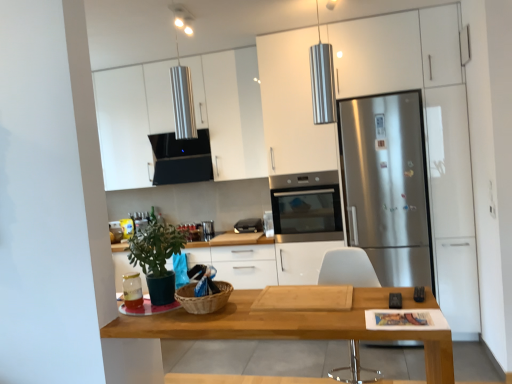
Question: Is stainless steel oven at center outside stainless steel refrigerator at right?

Choices:
 (A) yes
 (B) no

Answer: (A)

Question: Is stainless steel oven at center at the left side of stainless steel refrigerator at right?

Choices:
 (A) no
 (B) yes

Answer: (B)

Question: Does stainless steel oven at center have a smaller size compared to stainless steel refrigerator at right?

Choices:
 (A) no
 (B) yes

Answer: (B)

Question: Is stainless steel oven at center with stainless steel refrigerator at right?

Choices:
 (A) no
 (B) yes

Answer: (A)

Question: From a real-world perspective, does stainless steel oven at center stand above stainless steel refrigerator at right?

Choices:
 (A) yes
 (B) no

Answer: (A)

Question: From the image's perspective, is stainless steel oven at center located above stainless steel refrigerator at right?

Choices:
 (A) yes
 (B) no

Answer: (B)

Question: Does black plastic toaster at center, the second appliance viewed from the left, have a greater width compared to matte glass jar at lower left, placed as the second appliance when sorted from front to back?

Choices:
 (A) no
 (B) yes

Answer: (B)

Question: Considering the relative positions of black plastic toaster at center, which ranks as the first appliance in back-to-front order, and matte glass jar at lower left, which appears as the third appliance when viewed from the top, in the image provided, is black plastic toaster at center, which ranks as the first appliance in back-to-front order, to the right of matte glass jar at lower left, which appears as the third appliance when viewed from the top, from the viewer's perspective?

Choices:
 (A) yes
 (B) no

Answer: (A)

Question: Is black plastic toaster at center, arranged as the 1th appliance when viewed from the top, not close to matte glass jar at lower left, arranged as the first appliance when ordered from the bottom?

Choices:
 (A) yes
 (B) no

Answer: (A)

Question: Is black plastic toaster at center, which is counted as the 2th appliance, starting from the right, facing away from matte glass jar at lower left, which appears as the third appliance when viewed from the top?

Choices:
 (A) no
 (B) yes

Answer: (A)

Question: Is matte glass jar at lower left, placed as the second appliance when sorted from front to back, surrounded by black plastic toaster at center, which is counted as the 2th appliance, starting from the right?

Choices:
 (A) no
 (B) yes

Answer: (A)

Question: From the image's perspective, is black plastic toaster at center, which ranks as the first appliance in back-to-front order, below matte glass jar at lower left, which appears as the third appliance when viewed from the top?

Choices:
 (A) yes
 (B) no

Answer: (B)

Question: Is stainless steel refrigerator at right looking in the opposite direction of matte glass jar at lower left, which appears as the third appliance when viewed from the top?

Choices:
 (A) yes
 (B) no

Answer: (B)